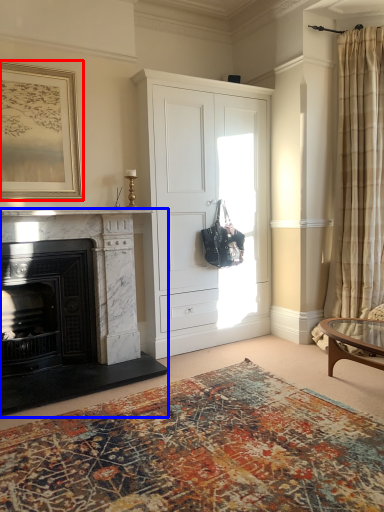
Question: Which object is further to the camera taking this photo, picture frame (highlighted by a red box) or fireplace (highlighted by a blue box)?

Choices:
 (A) picture frame
 (B) fireplace

Answer: (A)